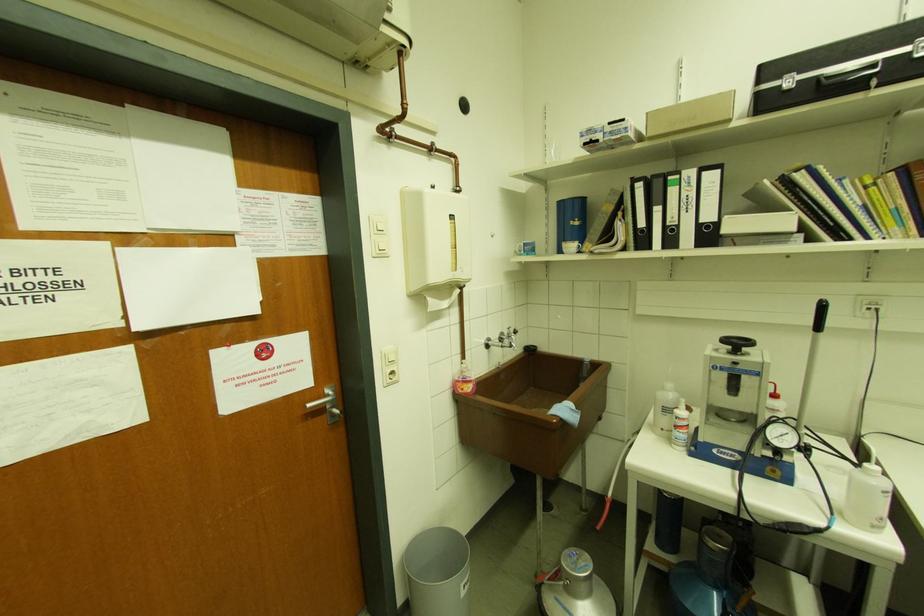
What do you see at coordinates (736, 344) in the screenshot?
I see `the black hand wheel` at bounding box center [736, 344].